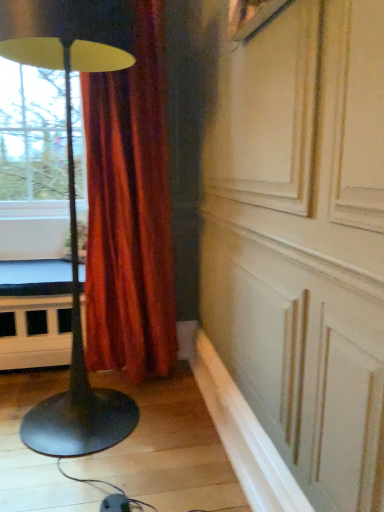
The height and width of the screenshot is (512, 384). What do you see at coordinates (73, 204) in the screenshot?
I see `black matte floor lamp at left` at bounding box center [73, 204].

Image resolution: width=384 pixels, height=512 pixels. Find the location of `black matte floor lamp at left`. black matte floor lamp at left is located at coordinates (73, 204).

Locate an element on the screen. black matte floor lamp at left is located at coordinates (73, 204).